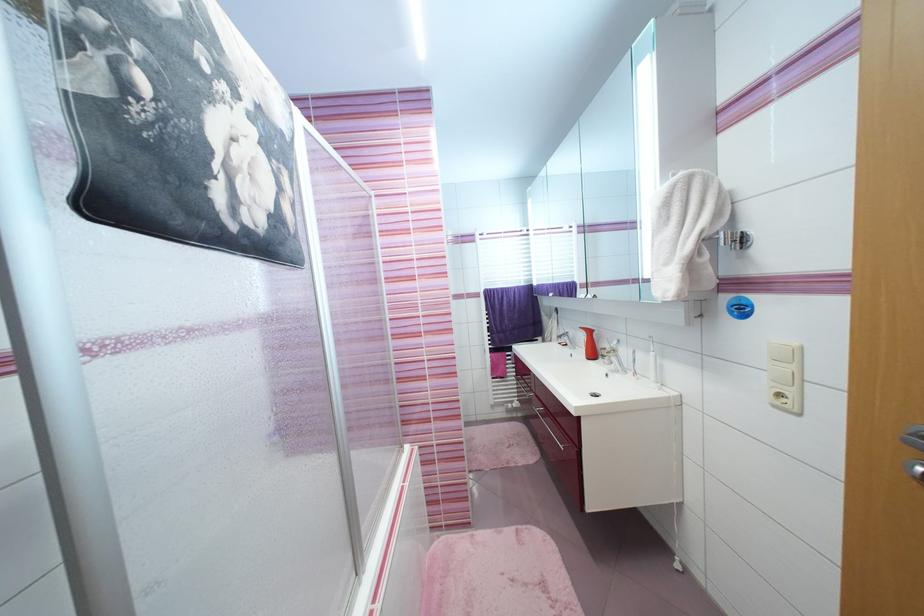
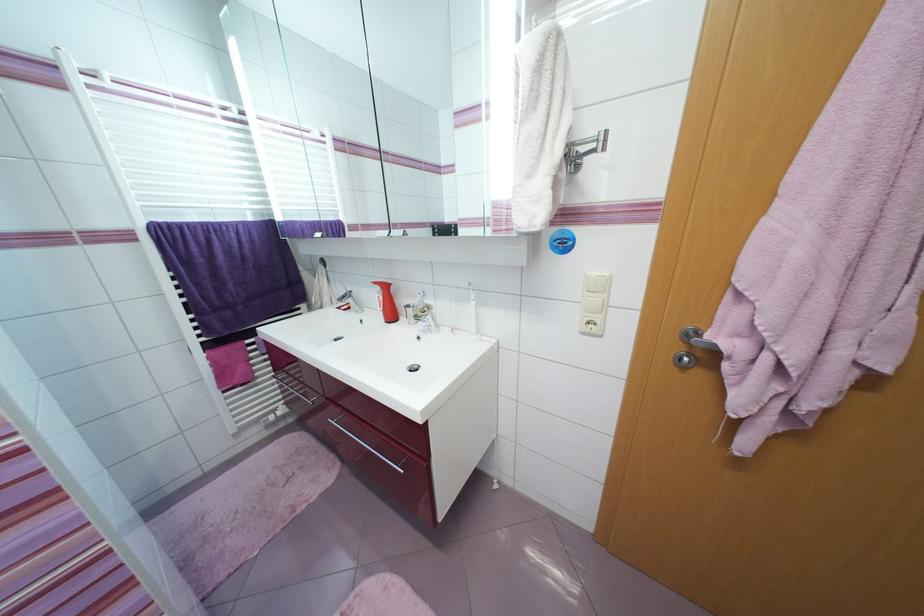
Question: The first image is from the beginning of the video and the second image is from the end. How did the camera likely rotate when shooting the video?

Choices:
 (A) Left
 (B) Right
 (C) Up
 (D) Down

Answer: (B)